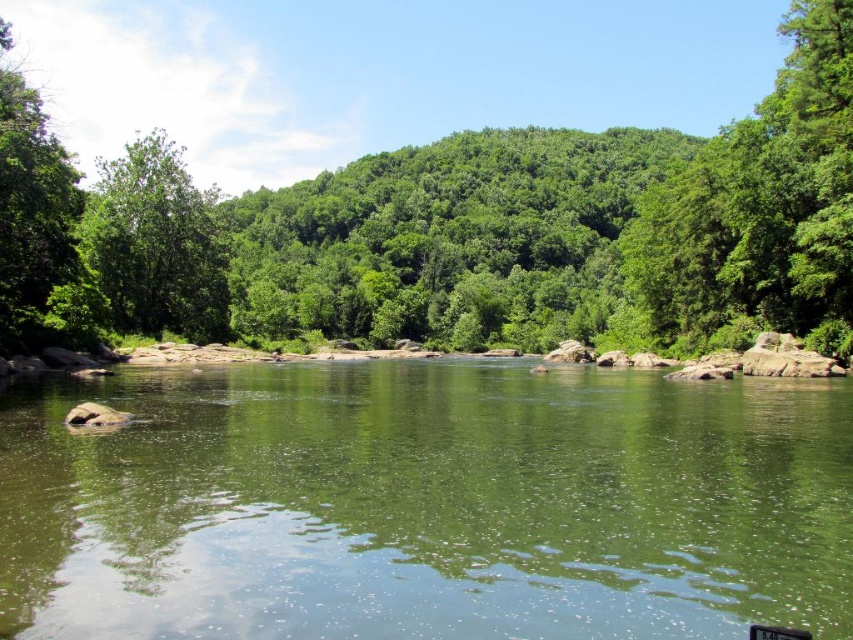
Who is more distant from viewer, (15, 620) or (206, 230)?

The point (206, 230) is behind.

Is the position of green smooth water at center less distant than that of green leafy tree at upper left?

Yes, it is.

Who is more distant from viewer, (7, 630) or (170, 188)?

The point (170, 188) is more distant.

The image size is (853, 640). What are the coordinates of `green smooth water at center` in the screenshot? It's located at (426, 504).

Which of these two, green leafy tree at center or green leafy tree at upper left, stands shorter?

With less height is green leafy tree at upper left.

Based on the photo, is green leafy tree at center to the left of green leafy tree at upper left from the viewer's perspective?

Yes, green leafy tree at center is to the left of green leafy tree at upper left.

Which is behind, point (610, 148) or point (111, 305)?

The point (610, 148) is more distant.

Locate an element on the screen. The height and width of the screenshot is (640, 853). green leafy tree at center is located at coordinates (456, 230).

This screenshot has height=640, width=853. What are the coordinates of `green leafy tree at center` in the screenshot? It's located at (456, 230).

Does point (1, 45) lie behind point (78, 259)?

No, (1, 45) is in front of (78, 259).

Identify the location of green leafy tree at center. (456, 230).